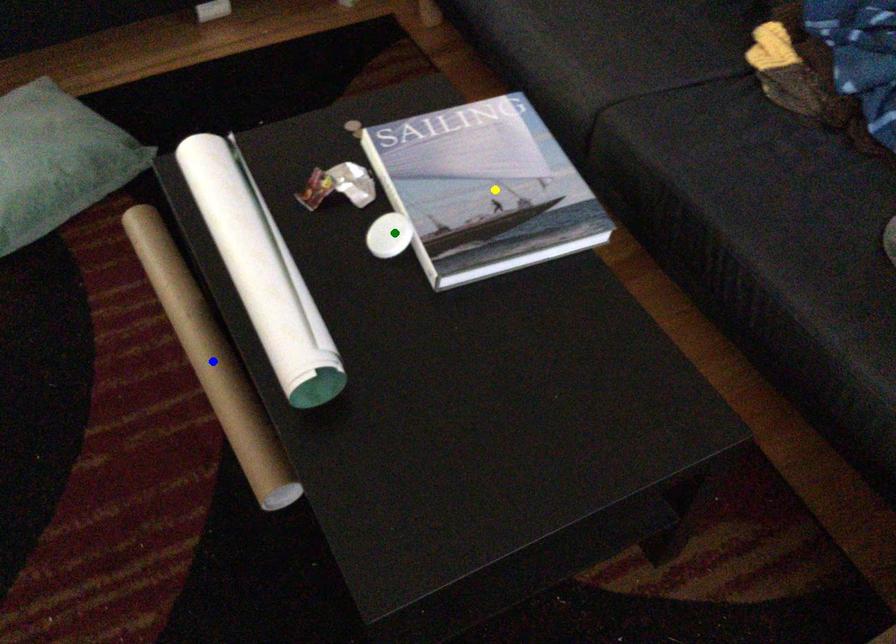
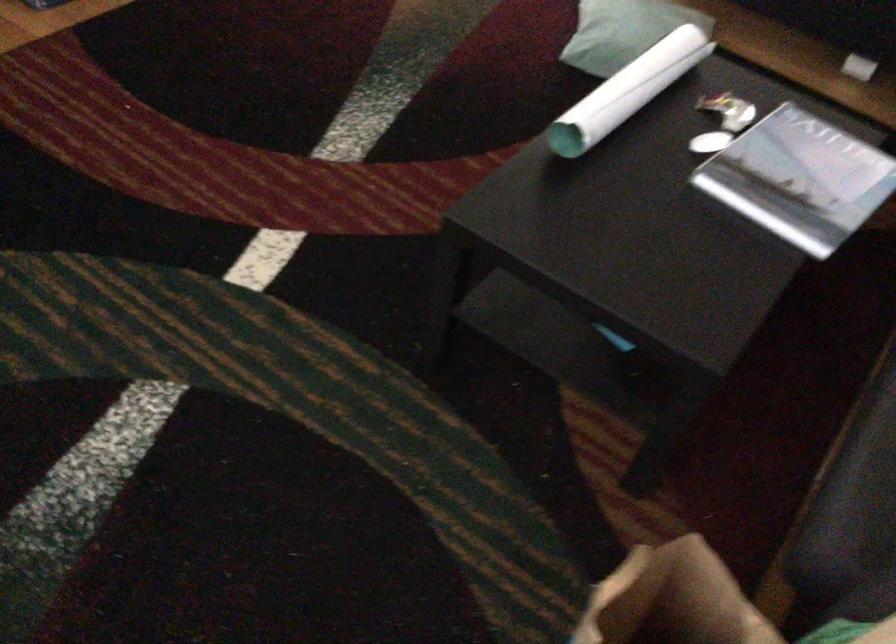
I am providing you with two images of the same scene from different viewpoints. Three points are marked in image1. Which point corresponds to a part or object that is occluded in image2?In image1, three points are marked. Which of them correspond to a part or object that is occluded in image2?Among the three points shown in image1, which one corresponds to a part or object that is no longer visible due to occlusion in image2?

blue point